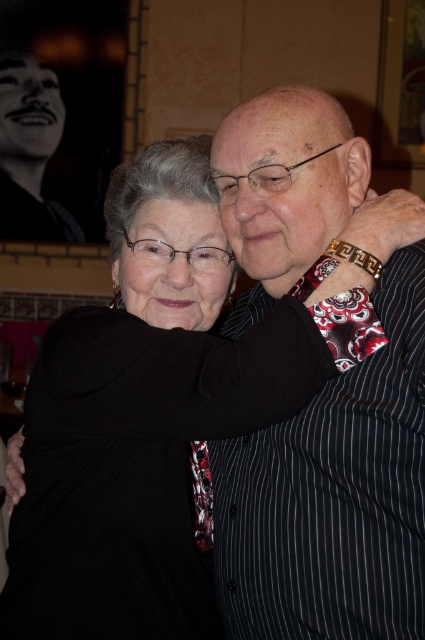
Can you confirm if black striped shirt at center is positioned to the right of black fabric at center?

Indeed, black striped shirt at center is positioned on the right side of black fabric at center.

Which of these two, black striped shirt at center or black fabric at center, stands taller?

black striped shirt at center

Who is more distant from viewer, (244, 323) or (212, 300)?

Point (244, 323)

Where is `black striped shirt at center`? black striped shirt at center is located at coordinates (334, 496).